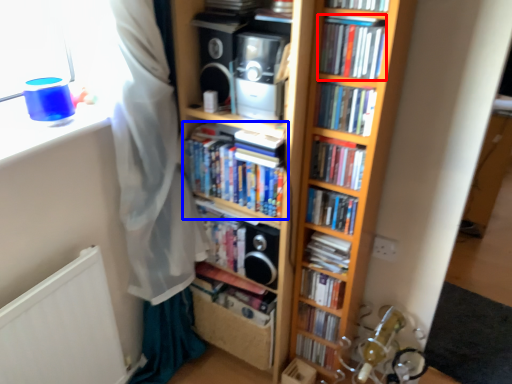
Question: Which of the following is the farthest to the observer, book (highlighted by a red box) or book (highlighted by a blue box)?

Choices:
 (A) book
 (B) book

Answer: (B)